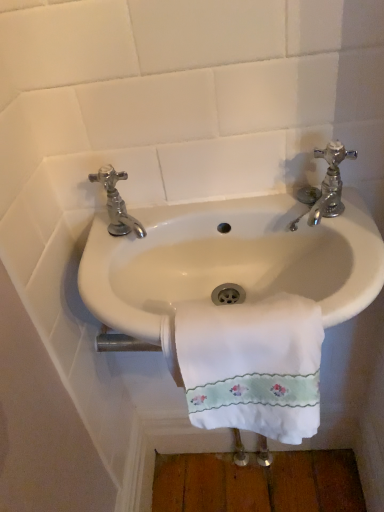
Question: Is white embroidered towel at center thinner than white ceramic sink at center?

Choices:
 (A) no
 (B) yes

Answer: (B)

Question: Is white embroidered towel at center positioned behind white ceramic sink at center?

Choices:
 (A) no
 (B) yes

Answer: (A)

Question: Is white embroidered towel at center oriented away from white ceramic sink at center?

Choices:
 (A) yes
 (B) no

Answer: (A)

Question: Can you confirm if white embroidered towel at center is smaller than white ceramic sink at center?

Choices:
 (A) no
 (B) yes

Answer: (B)

Question: From a real-world perspective, is white embroidered towel at center on white ceramic sink at center?

Choices:
 (A) no
 (B) yes

Answer: (A)

Question: Is white embroidered towel at center wider than white ceramic sink at center?

Choices:
 (A) no
 (B) yes

Answer: (A)

Question: Are white ceramic sink at center and white embroidered towel at center located far from each other?

Choices:
 (A) yes
 (B) no

Answer: (B)

Question: From a real-world perspective, is white ceramic sink at center beneath white embroidered towel at center?

Choices:
 (A) yes
 (B) no

Answer: (B)

Question: Can you confirm if white ceramic sink at center is taller than white embroidered towel at center?

Choices:
 (A) yes
 (B) no

Answer: (B)

Question: Is white ceramic sink at center positioned with its back to white embroidered towel at center?

Choices:
 (A) yes
 (B) no

Answer: (A)

Question: From the image's perspective, is white ceramic sink at center located beneath white embroidered towel at center?

Choices:
 (A) yes
 (B) no

Answer: (B)

Question: Can you confirm if white ceramic sink at center is shorter than white embroidered towel at center?

Choices:
 (A) no
 (B) yes

Answer: (B)

Question: Is chrome metallic faucet at upper right, the 2th tap positioned from the left, at the back of white ceramic sink at center?

Choices:
 (A) yes
 (B) no

Answer: (B)